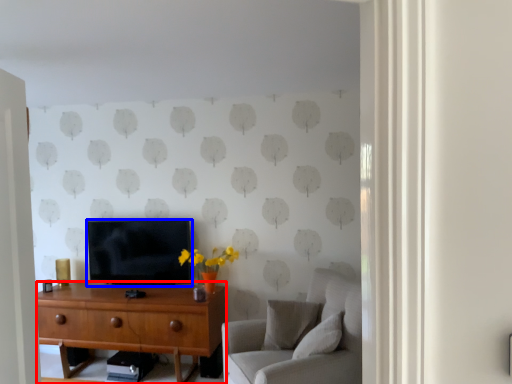
Question: Among these objects, which one is farthest to the camera, desk (highlighted by a red box) or television (highlighted by a blue box)?

Choices:
 (A) desk
 (B) television

Answer: (B)